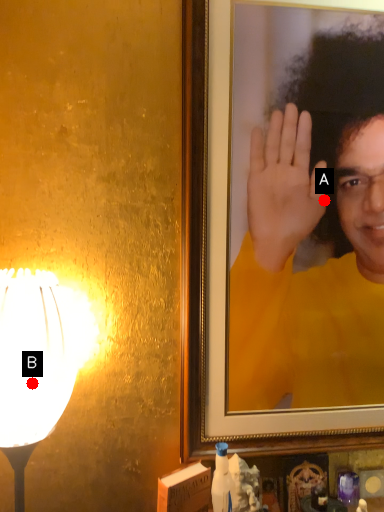
Question: Two points are circled on the image, labeled by A and B beside each circle. Which of the following is the farthest from the observer?

Choices:
 (A) A is further
 (B) B is further

Answer: (A)